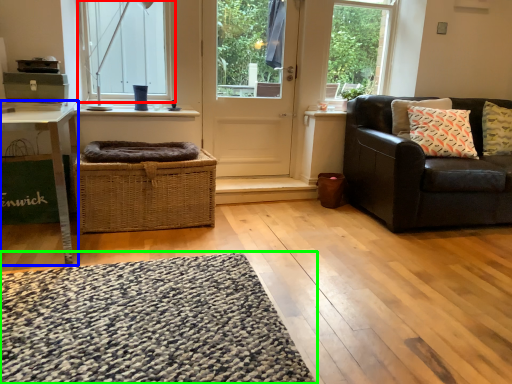
Question: Which object is the farthest from window (highlighted by a red box)? Choose among these: table (highlighted by a blue box) or mat (highlighted by a green box).

Choices:
 (A) table
 (B) mat

Answer: (B)